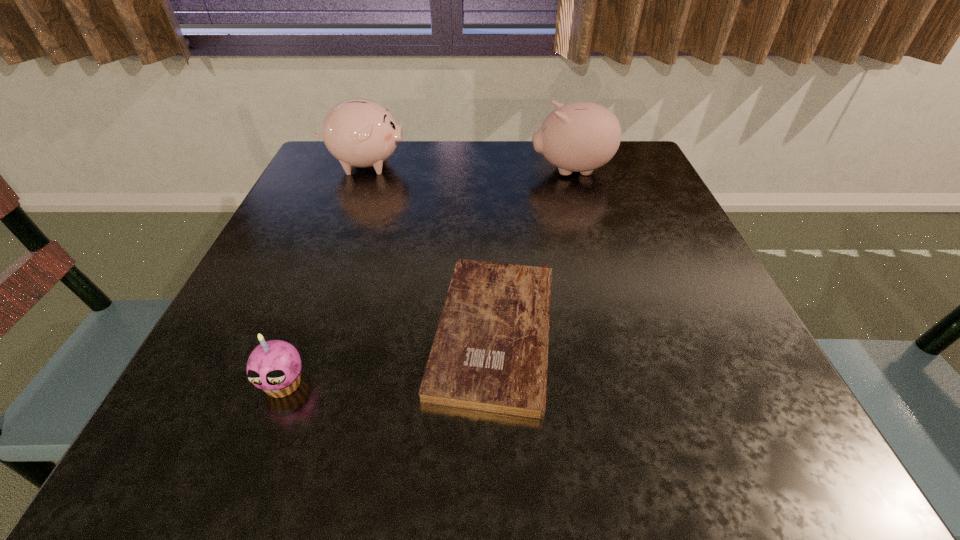
Identify the location of vacant space at the far right corner of the desktop. This screenshot has height=540, width=960. (634, 152).

Where is `blank region between the cupcake and the right piggy bank`? blank region between the cupcake and the right piggy bank is located at coordinates (427, 277).

This screenshot has height=540, width=960. I want to click on vacant area between the left piggy bank and the second shortest object, so click(x=324, y=274).

This screenshot has width=960, height=540. What are the coordinates of `vacant region between the second shortest object and the right piggy bank` in the screenshot? It's located at (427, 277).

Locate an element on the screen. free space between the second shortest object and the right piggy bank is located at coordinates (427, 277).

What are the coordinates of `free area in between the left piggy bank and the third tallest object` in the screenshot? It's located at (324, 274).

This screenshot has height=540, width=960. What are the coordinates of `vacant space that's between the left piggy bank and the right piggy bank` in the screenshot? It's located at (468, 167).

Locate an element on the screen. This screenshot has height=540, width=960. unoccupied area between the Bible and the left piggy bank is located at coordinates (429, 248).

Find the location of a particular element. vacant point located between the left piggy bank and the right piggy bank is located at coordinates (468, 167).

Find the location of `empty location between the right piggy bank and the shortest object`. empty location between the right piggy bank and the shortest object is located at coordinates (533, 251).